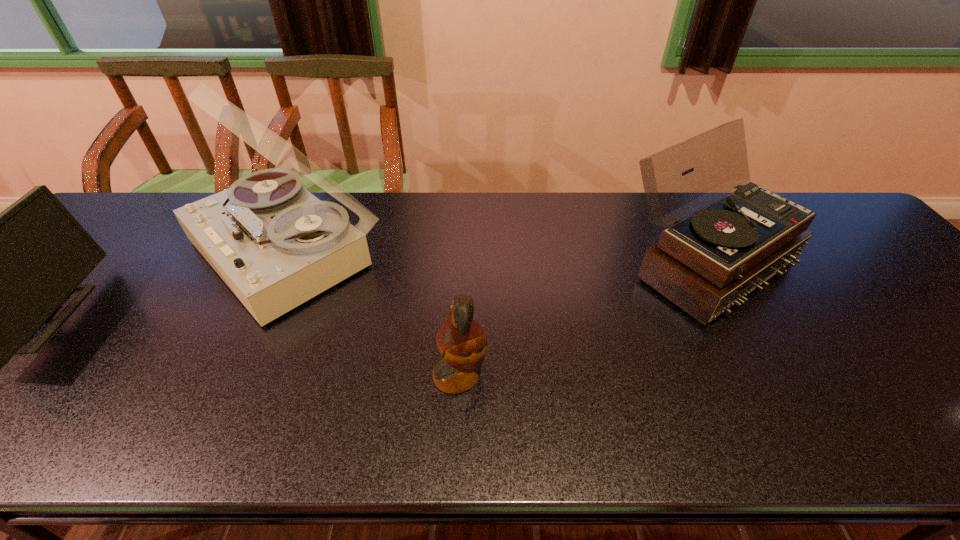
What are the coordinates of `the tallest object` in the screenshot? It's located at (275, 245).

The height and width of the screenshot is (540, 960). I want to click on the left record player, so click(x=275, y=245).

Locate an element on the screen. the right record player is located at coordinates (706, 263).

Where is `the rightmost object`? This screenshot has height=540, width=960. the rightmost object is located at coordinates (706, 263).

Identify the location of the third object from left to right. Image resolution: width=960 pixels, height=540 pixels. (462, 343).

Find the location of a particular element. This screenshot has height=540, width=960. vacant area situated on the left of the taller record player is located at coordinates tap(126, 250).

Where is `vacant region located 0.120m on the left of the third shortest object`? vacant region located 0.120m on the left of the third shortest object is located at coordinates (572, 263).

Locate an element on the screen. vacant space located on the face of the parrot is located at coordinates 606,375.

In the image, there is a desktop. Identify the location of vacant space at the far edge. (481, 228).

What are the coordinates of `blank space at the near edge of the desktop` in the screenshot? It's located at (419, 418).